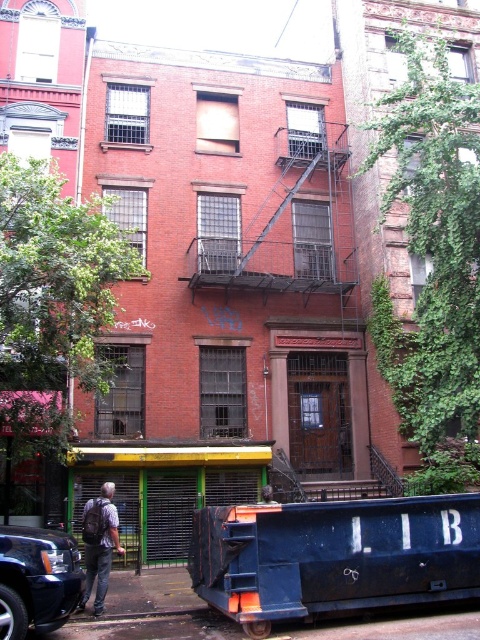
You are standing on the sidewalk in front of the building and notice two points marked on the ground. The first point is labeled as point (73, 577) and the second is point (88, 540). If you want to walk towards the building entrance, which point should you step on first?

You should step on point (73, 577) first because it is in front of point (88, 540), meaning it is closer to the building entrance.

You are a delivery person trying to park your shiny black suv at lower left near the building entrance. There is a denim jacket at lower left already parked there. Can you fit your SUV into the available space?

The shiny black suv at lower left might be wider than the denim jacket at lower left, so it is uncertain if it will fit. Check the width of the space before attempting to park.